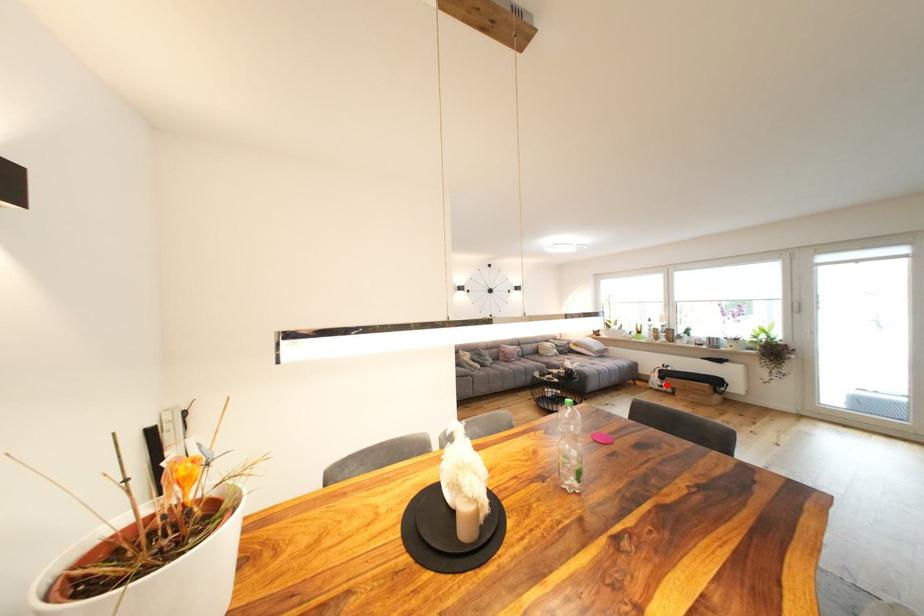
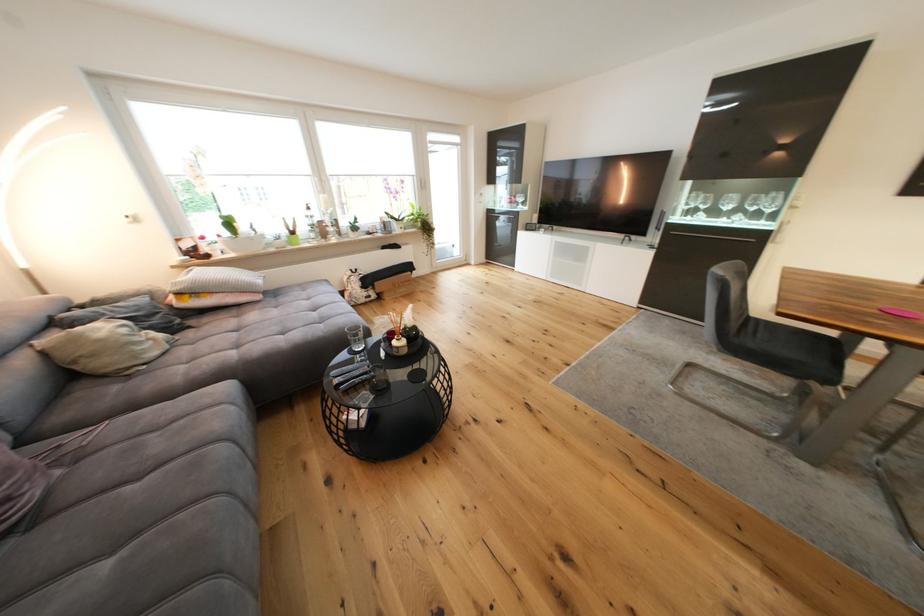
Question: I am providing you with two images of the same scene from different viewpoints. In image1, a red point is highlighted. Considering the same 3D point in image2, which of the following is correct?

Choices:
 (A) It is closer
 (B) It is farther

Answer: (A)